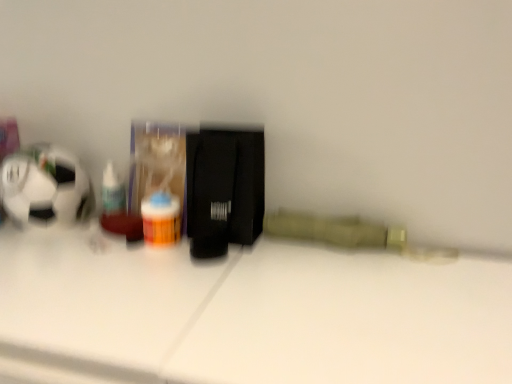
What do you see at coordinates (247, 314) in the screenshot? The image size is (512, 384). I see `white glossy table at center` at bounding box center [247, 314].

Measure the distance between translucent plastic pill bottle at center and camera.

They are 27.22 inches apart.

Image resolution: width=512 pixels, height=384 pixels. Find the location of `white glossy table at center`. white glossy table at center is located at coordinates (247, 314).

Identify the location of toiletry that appears above the white glossy table at center (from a real-world perspective). Image resolution: width=512 pixels, height=384 pixels. (112, 192).

From the image's perspective, between translucent plastic bottle at left and white glossy table at center, which one is located above?

translucent plastic bottle at left appears higher in the image.

Is there a large distance between translucent plastic bottle at left and white glossy table at center?

translucent plastic bottle at left is actually quite close to white glossy table at center.

From the picture: Is translucent plastic bottle at left oriented away from white glossy table at center?

No, translucent plastic bottle at left's orientation is not away from white glossy table at center.

Looking at this image, which of these two, white glossy table at center or translucent plastic pill bottle at center, is wider?

white glossy table at center is wider.

Considering the points (314, 319) and (168, 234), which point is behind, point (314, 319) or point (168, 234)?

The point (168, 234) is behind.

From the image's perspective, between white glossy table at center and translucent plastic pill bottle at center, who is located below?

white glossy table at center is shown below in the image.

From a real-world perspective, which is physically above, white glossy table at center or translucent plastic pill bottle at center?

translucent plastic pill bottle at center, from a real-world perspective.

From the image's perspective, is translucent plastic bottle at left located above translucent plastic pill bottle at center?

Yes.

Are translucent plastic bottle at left and translucent plastic pill bottle at center beside each other?

No, translucent plastic bottle at left is not with translucent plastic pill bottle at center.

Considering the sizes of objects translucent plastic bottle at left and translucent plastic pill bottle at center in the image provided, who is smaller, translucent plastic bottle at left or translucent plastic pill bottle at center?

translucent plastic bottle at left.

From a real-world perspective, is white glossy table at center on top of translucent plastic bottle at left?

No, from a real-world perspective, white glossy table at center is not on top of translucent plastic bottle at left.

The image size is (512, 384). In order to click on table that is on the right side of translucent plastic bottle at left in this screenshot , I will do `click(247, 314)`.

Is white glossy table at center placed right next to translucent plastic bottle at left?

No, white glossy table at center is not in contact with translucent plastic bottle at left.

Can you confirm if white glossy table at center is positioned to the left of translucent plastic bottle at left?

In fact, white glossy table at center is to the right of translucent plastic bottle at left.

From the image's perspective, is translucent plastic pill bottle at center on top of translucent plastic bottle at left?

No, from the image's perspective, translucent plastic pill bottle at center is not on top of translucent plastic bottle at left.

Does translucent plastic pill bottle at center turn towards translucent plastic bottle at left?

No.

In the image, is translucent plastic pill bottle at center positioned in front of or behind translucent plastic bottle at left?

translucent plastic pill bottle at center is positioned closer to the viewer than translucent plastic bottle at left.

From a real-world perspective, is translucent plastic pill bottle at center below white glossy table at center?

Incorrect, from a real-world perspective, translucent plastic pill bottle at center is higher than white glossy table at center.

Are translucent plastic pill bottle at center and white glossy table at center far apart?

That's not correct — translucent plastic pill bottle at center is a little close to white glossy table at center.

Is the depth of translucent plastic pill bottle at center greater than that of white glossy table at center?

Yes, translucent plastic pill bottle at center is behind white glossy table at center.

Where is `bottle positioned vertically above the white glossy table at center (from a real-world perspective)`? The width and height of the screenshot is (512, 384). bottle positioned vertically above the white glossy table at center (from a real-world perspective) is located at coordinates (161, 218).

Identify the location of toiletry above the white glossy table at center (from the image's perspective). The width and height of the screenshot is (512, 384). (112, 192).

Find the location of a particular element. This screenshot has width=512, height=384. table located on the right of translucent plastic pill bottle at center is located at coordinates (247, 314).

Based on their spatial positions, is translucent plastic pill bottle at center or translucent plastic bottle at left closer to white glossy table at center?

Based on the image, translucent plastic pill bottle at center appears to be nearer to white glossy table at center.

From the image, which object appears to be nearer to translucent plastic bottle at left, translucent plastic pill bottle at center or white glossy table at center?

translucent plastic pill bottle at center.

From the picture: Looking at the image, which one is located closer to translucent plastic bottle at left, white glossy table at center or translucent plastic pill bottle at center?

Among the two, translucent plastic pill bottle at center is located nearer to translucent plastic bottle at left.

Which object lies nearer to the anchor point white glossy table at center, translucent plastic bottle at left or translucent plastic pill bottle at center?

The object closer to white glossy table at center is translucent plastic pill bottle at center.

In the scene shown: Which object lies further to the anchor point translucent plastic pill bottle at center, white glossy table at center or translucent plastic bottle at left?

white glossy table at center lies further to translucent plastic pill bottle at center than the other object.

Based on their spatial positions, is translucent plastic bottle at left or white glossy table at center further from translucent plastic pill bottle at center?

Among the two, white glossy table at center is located further to translucent plastic pill bottle at center.

The width and height of the screenshot is (512, 384). In order to click on bottle positioned between white glossy table at center and translucent plastic bottle at left from near to far in this screenshot , I will do `click(161, 218)`.